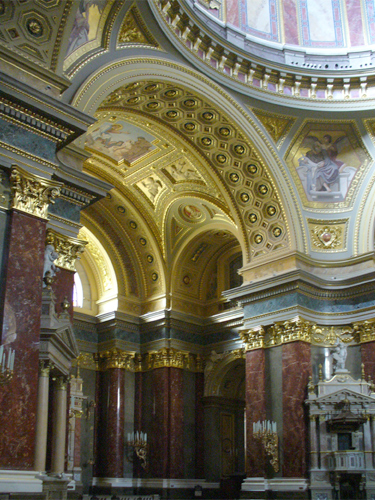
Identify the location of statue. The width and height of the screenshot is (375, 500). (341, 348).